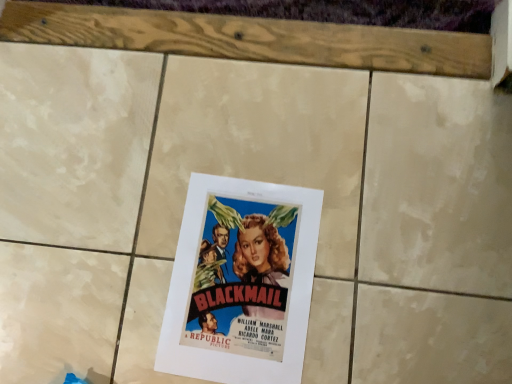
This screenshot has height=384, width=512. I want to click on free point above matte paper poster at center (from a real-world perspective), so click(x=240, y=277).